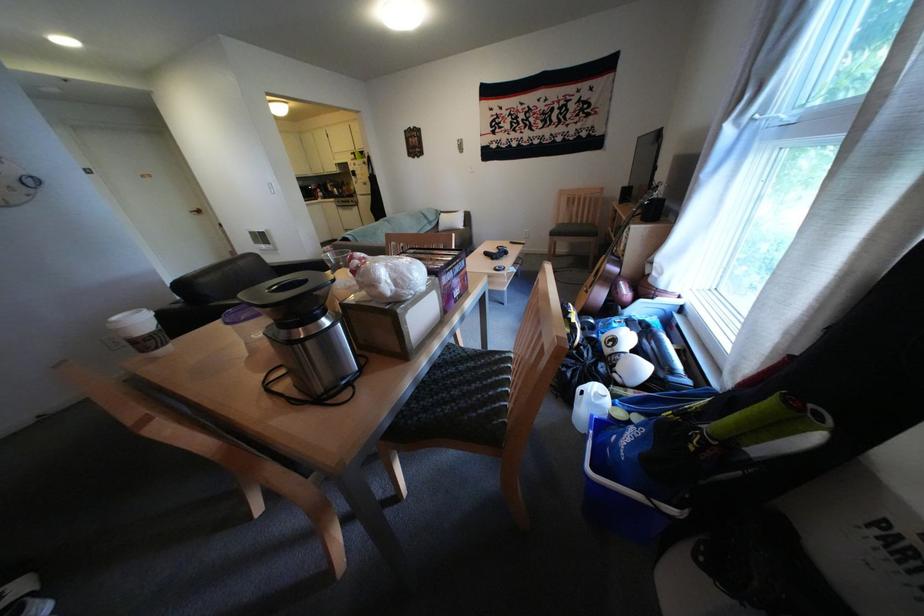
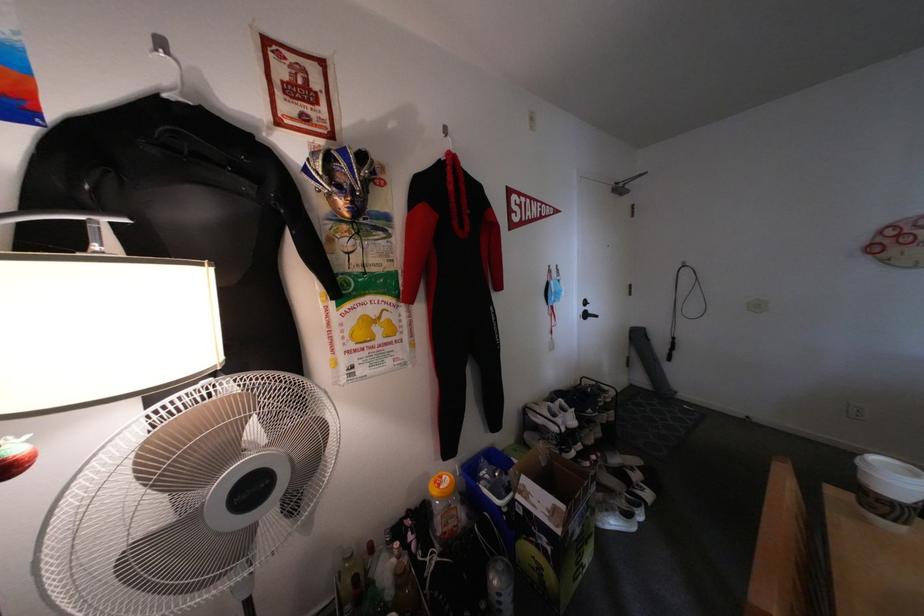
The point at (177, 346) is marked in the first image. Where is the corresponding point in the second image?

(909, 523)